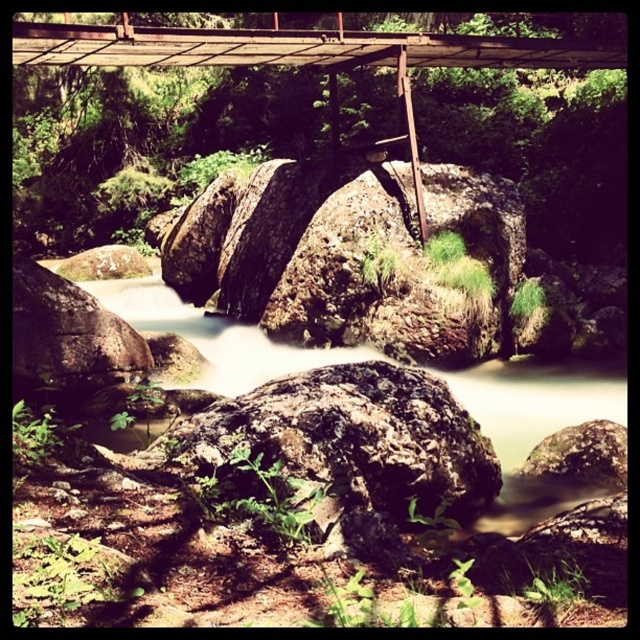
You are a hiker carrying a backpack weighing 15 kilograms. You need to cross the stream but there are obstacles. The brown rock at center and the rusty metal bridge at upper center are in your path. Which one is closer to you if you are standing at the starting point on the left bank?

The brown rock at center is closer to you than the rusty metal bridge at upper center since they are 4.68 meters apart.

You are a hiker carrying a backpack and need to cross the stream. You see a brown rock at center and a rusty metal bridge at upper center. Which one is wider so you can safely walk across?

The brown rock at center might be wider than rusty metal bridge at upper center, so it is safer to walk across the brown rock at center.